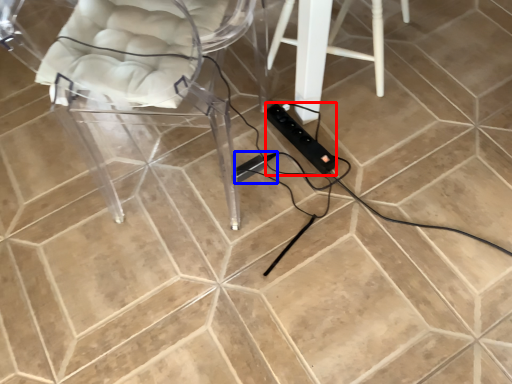
Question: Which object appears closest to the camera in this image, extension cord (highlighted by a red box) or extension cord (highlighted by a blue box)?

Choices:
 (A) extension cord
 (B) extension cord

Answer: (A)